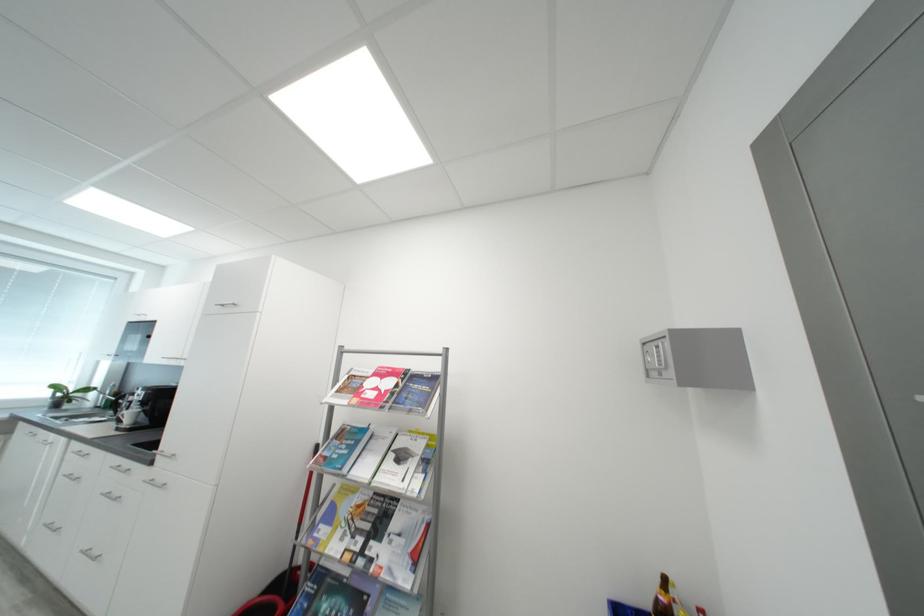
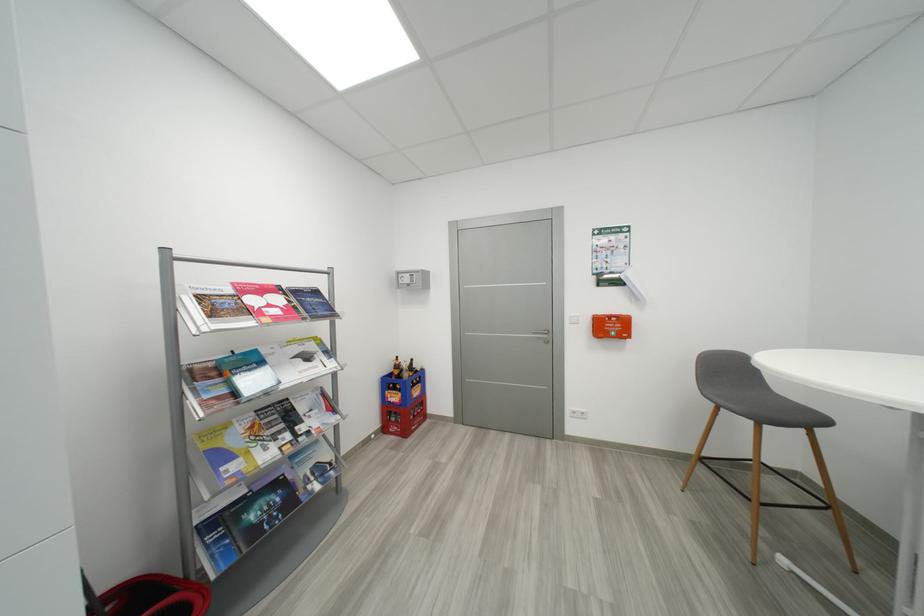
Find the pixel in the second image that matches (x=383, y=395) in the first image.

(286, 310)